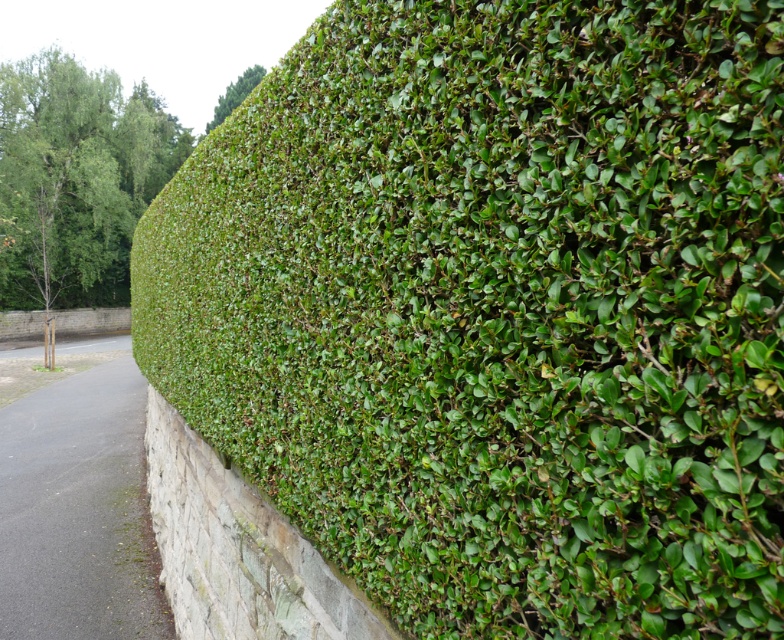
Is green leafy tree at upper left above green leafy hedge at upper left?

Incorrect, green leafy tree at upper left is not positioned above green leafy hedge at upper left.

Does green leafy tree at upper left have a lesser width compared to green leafy hedge at upper left?

Incorrect, green leafy tree at upper left's width is not less than green leafy hedge at upper left's.

The width and height of the screenshot is (784, 640). What do you see at coordinates (75, 179) in the screenshot?
I see `green leafy tree at upper left` at bounding box center [75, 179].

The image size is (784, 640). In order to click on green leafy tree at upper left in this screenshot , I will do `click(75, 179)`.